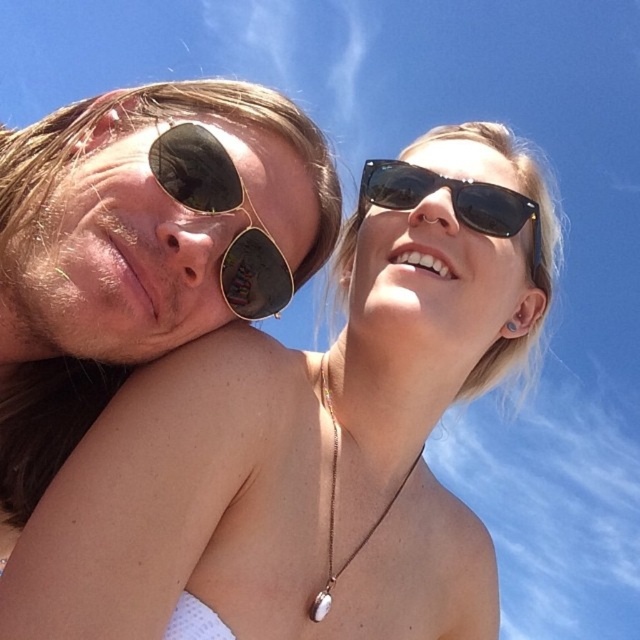
You are a photographer trying to capture a closeup of the gold mirrored sunglasses at upper left. Based on the scene description, where should you focus your camera? Please provide coordinates in the format of a point like point. (224,212).

The gold mirrored sunglasses at upper left are located at point (224,212), so you should focus your camera there.

You are a photographer trying to capture a closeup shot of the silver metallic necklace at center. You have a lens that can focus on objects within 1 meter. The gold mirrored sunglasses at upper left are in between you and the necklace. Can you focus on the necklace without moving the sunglasses?

The gold mirrored sunglasses at upper left is closer to the viewer than silver metallic necklace at center, so the necklace is further away. Since the sunglasses are in between you and the necklace, they are closer to the lens. If your lens can focus within 1 meter, you need to check the distance between you and the sunglasses. If the sunglasses are within 1 meter, focusing on them would make the necklace out of focus. If the sunglasses are beyond 1 meter, you might focus on the necklace. However, without a

You are a photographer trying to capture a closeup shot of the gold mirrored sunglasses at upper left and the black reflective sunglasses at upper right. Which sunglasses are positioned more to the left side?

The gold mirrored sunglasses at upper left is positioned on the left side of black reflective sunglasses at upper right, so it is more to the left.